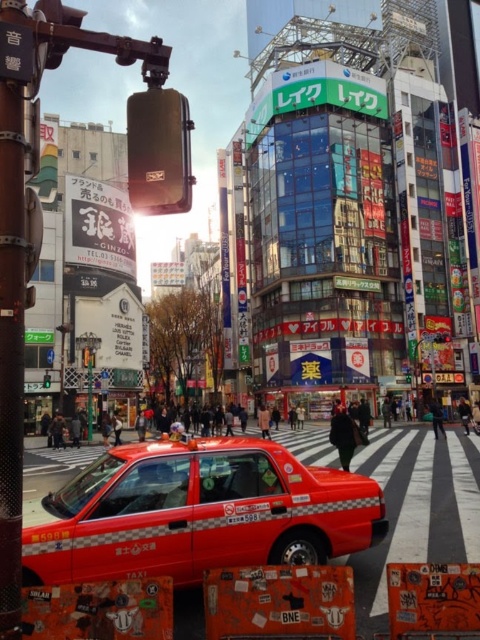
Question: Which point is closer to the camera?

Choices:
 (A) (43, 381)
 (B) (446, 337)
 (C) (260, 474)

Answer: (C)

Question: Which object is positioned farthest from the metallic rectangular at center?

Choices:
 (A) shiny red taxi at center
 (B) green glass traffic light at upper center

Answer: (A)

Question: Does shiny red taxi at center appear over metallic rectangular at center?

Choices:
 (A) no
 (B) yes

Answer: (A)

Question: Can you confirm if shiny red taxi at center is bigger than green glass traffic light at upper center?

Choices:
 (A) no
 (B) yes

Answer: (B)

Question: In this image, where is metallic rectangular at center located relative to green glass traffic light at upper center?

Choices:
 (A) above
 (B) below

Answer: (A)

Question: Estimate the real-world distances between objects in this image. Which object is farther from the metallic rectangular at center?

Choices:
 (A) shiny red taxi at center
 (B) green glass traffic light at upper center

Answer: (A)